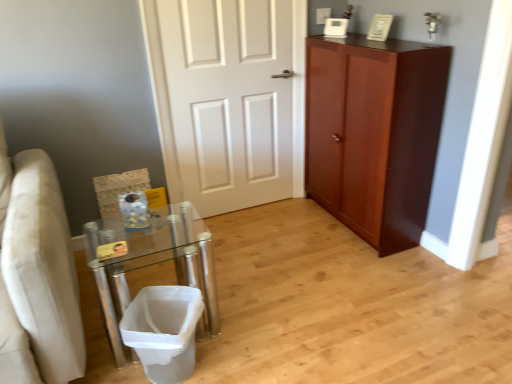
Question: In terms of size, does clear glass table at lower left appear bigger or smaller than mahogany wood cabinet at right?

Choices:
 (A) small
 (B) big

Answer: (A)

Question: From their relative heights in the image, would you say clear glass table at lower left is taller or shorter than mahogany wood cabinet at right?

Choices:
 (A) short
 (B) tall

Answer: (A)

Question: Estimate the real-world distances between objects in this image. Which object is farther from the white mesh laundry basket at lower left?

Choices:
 (A) mahogany wood cabinet at right
 (B) white painted wood door at center
 (C) clear glass table at lower left

Answer: (A)

Question: Which of these objects is positioned closest to the clear glass table at lower left?

Choices:
 (A) mahogany wood cabinet at right
 (B) white painted wood door at center
 (C) white mesh laundry basket at lower left

Answer: (C)